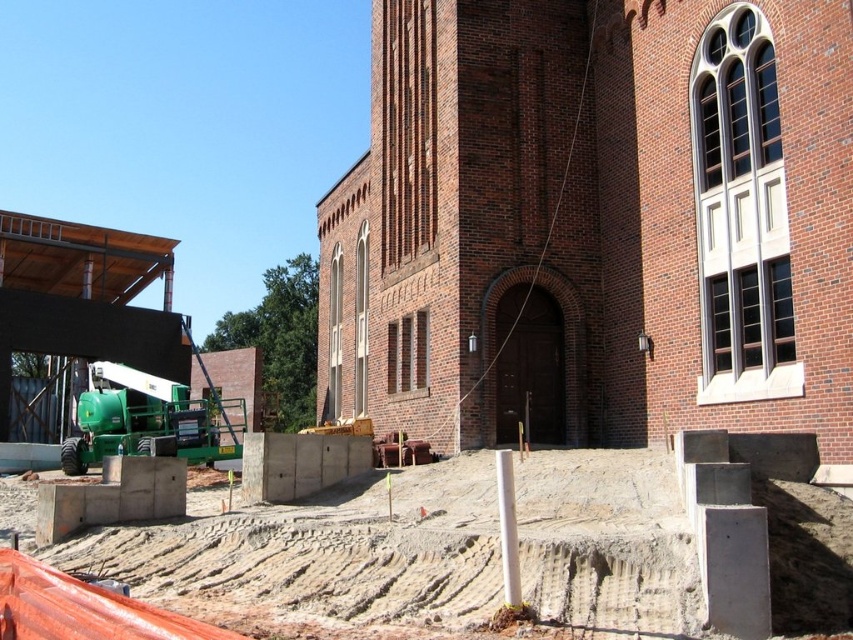
Question: Considering the relative positions of concrete at center and green metallic crane at left in the image provided, where is concrete at center located with respect to green metallic crane at left?

Choices:
 (A) above
 (B) below

Answer: (A)

Question: Does concrete at center appear on the left side of green metallic crane at left?

Choices:
 (A) no
 (B) yes

Answer: (A)

Question: Which point is closer to the camera taking this photo?

Choices:
 (A) (94, 374)
 (B) (722, 506)

Answer: (B)

Question: Among these points, which one is nearest to the camera?

Choices:
 (A) (578, 588)
 (B) (202, 448)

Answer: (A)

Question: Is concrete at center bigger than green metallic crane at left?

Choices:
 (A) no
 (B) yes

Answer: (A)